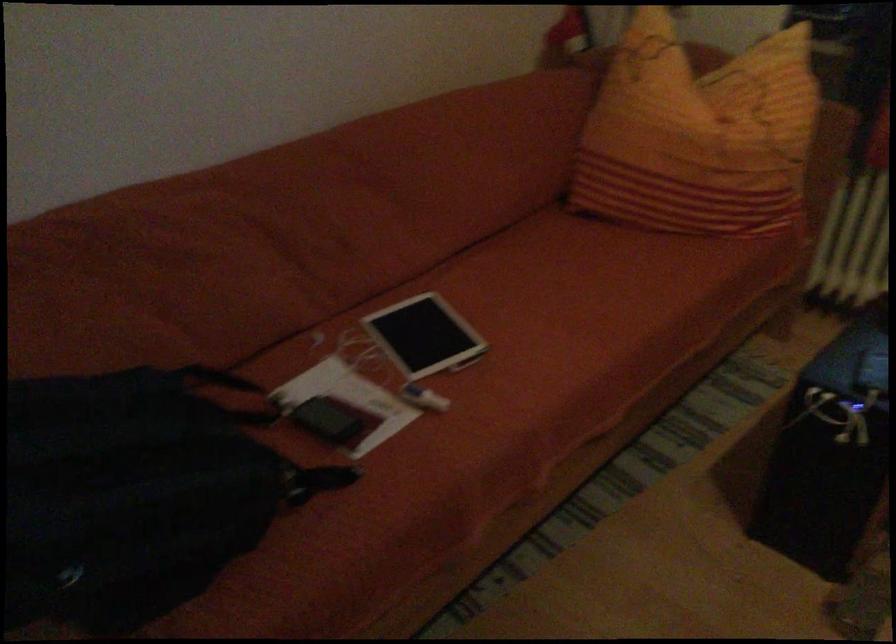
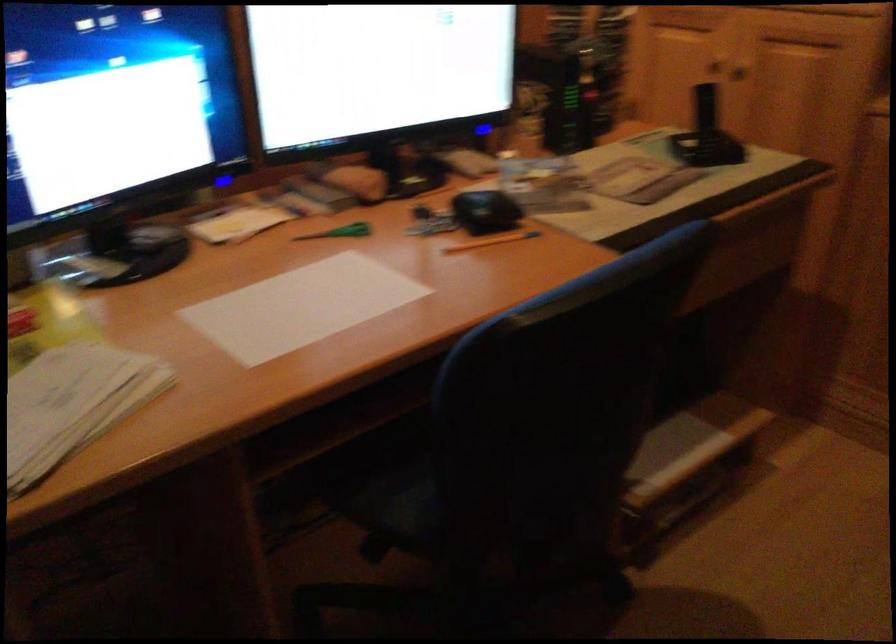
Based on the continuous images, in which direction is the camera rotating?

The rotation direction of the camera is right-down.